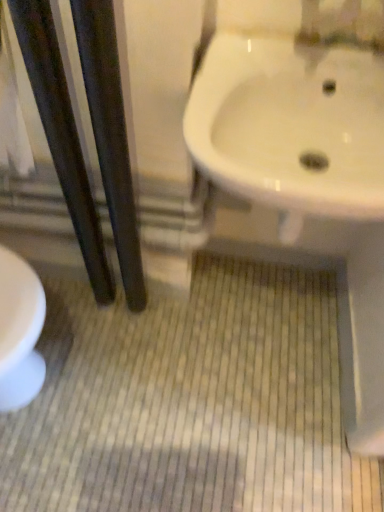
Find the location of a particular element. Image resolution: width=384 pixels, height=512 pixels. free space in front of black glossy poles at left, the 1th pole viewed from the right is located at coordinates (129, 362).